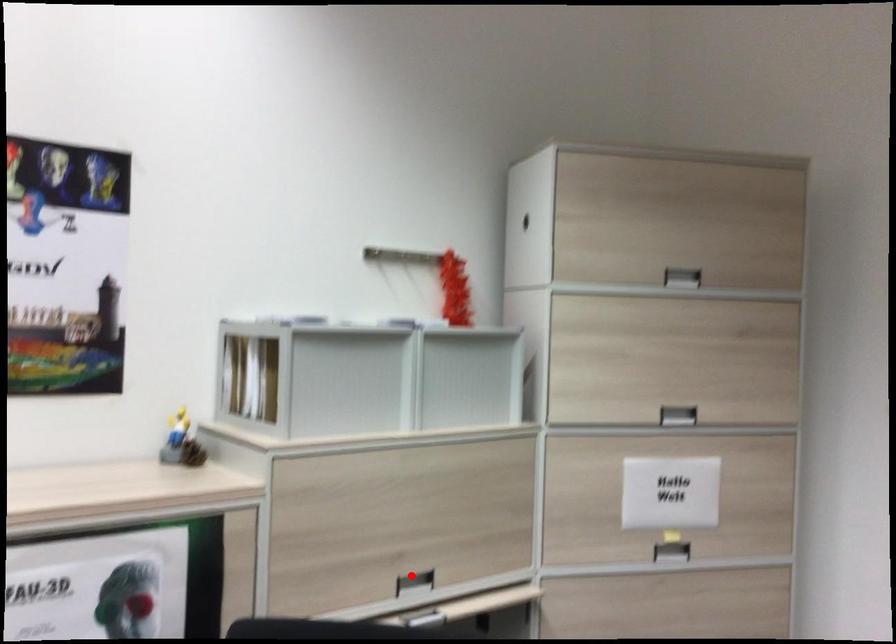
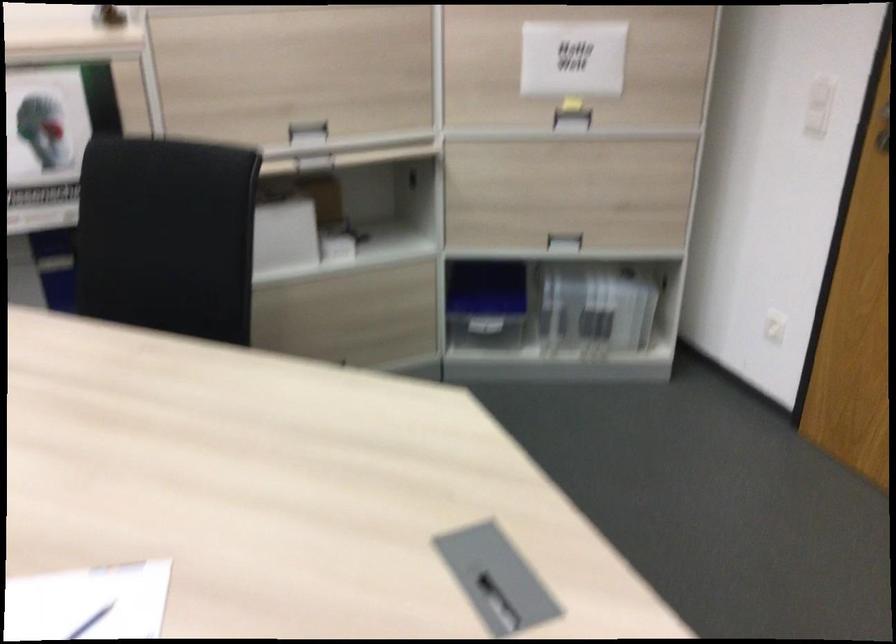
Question: A red point is marked in image1. In image2, is the corresponding 3D point closer to the camera or farther? Reply with the corresponding letter.

Choices:
 (A) The corresponding 3D point is closer.
 (B) The corresponding 3D point is farther.

Answer: (B)